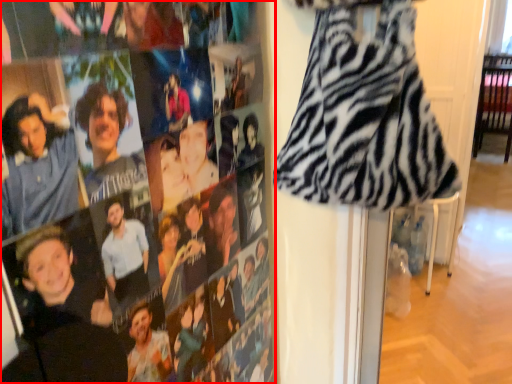
Question: From the image's perspective, considering the relative positions of person (annotated by the red box) and fancy dress in the image provided, where is person (annotated by the red box) located with respect to the staircase?

Choices:
 (A) above
 (B) below

Answer: (B)